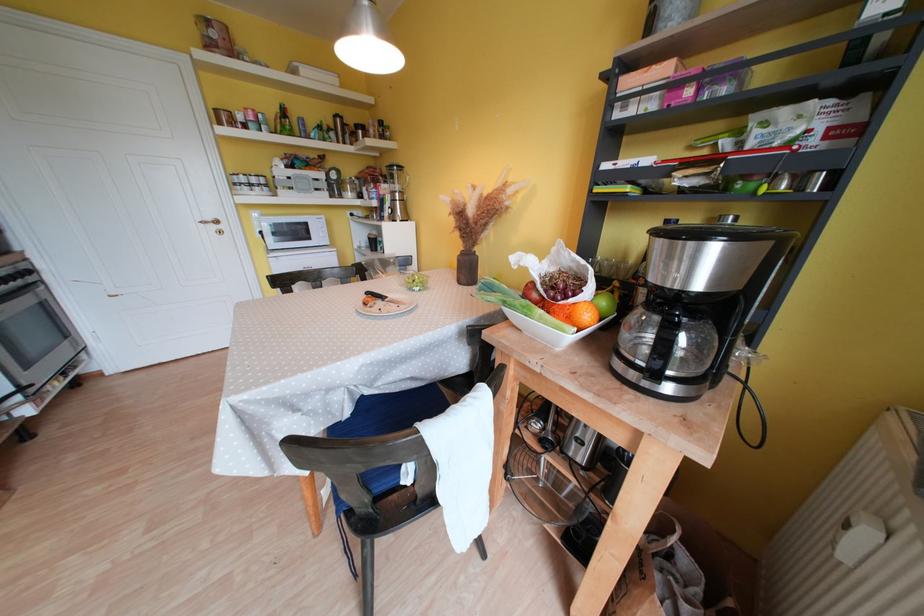
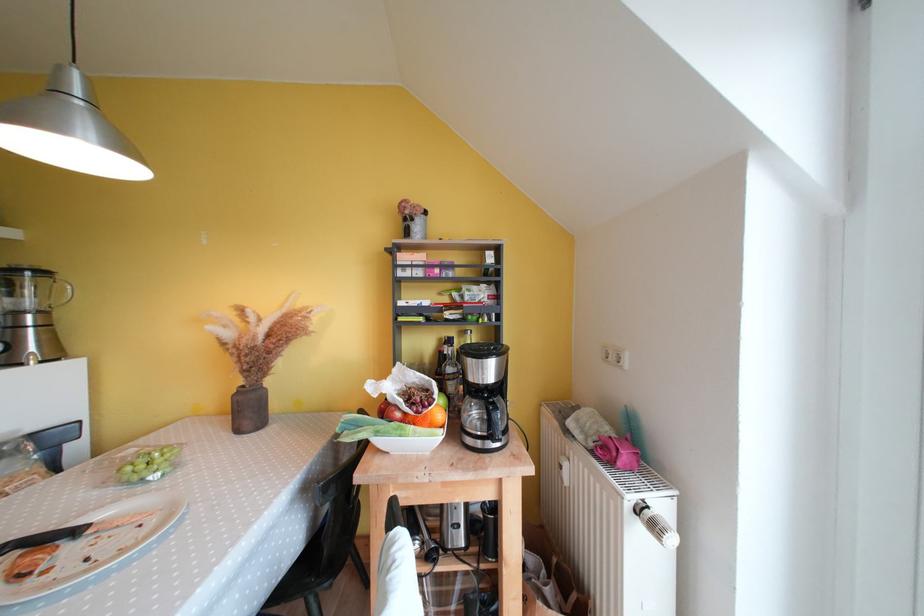
Find the pixel in the second image that matches the point at 472,275 in the first image.

(256, 416)